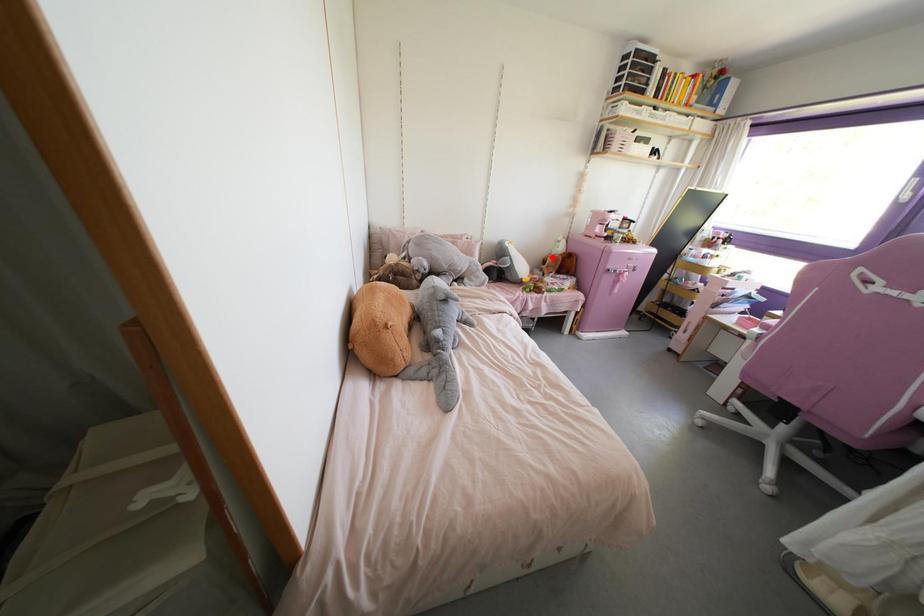
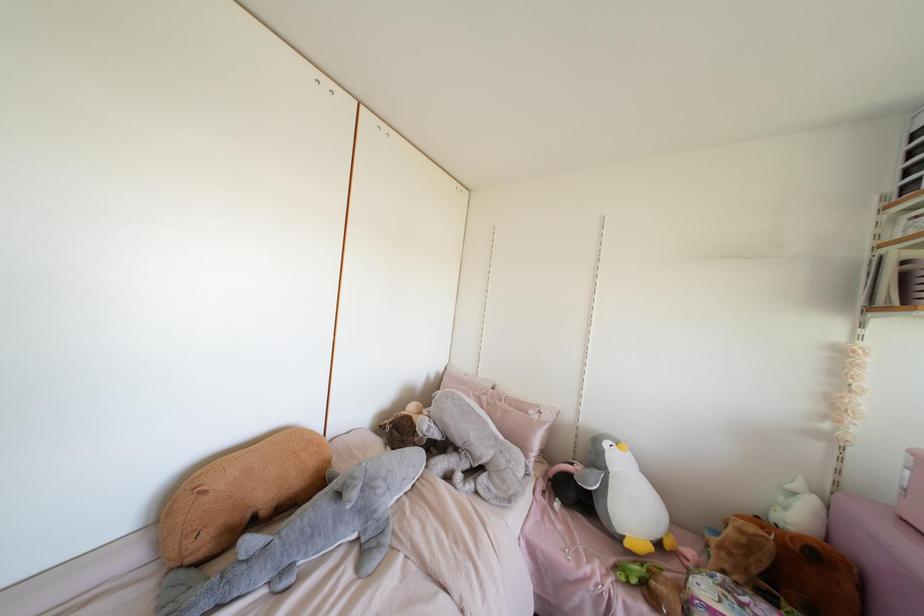
In the second image, find the point that corresponds to the highlighted location in the first image.

(739, 531)